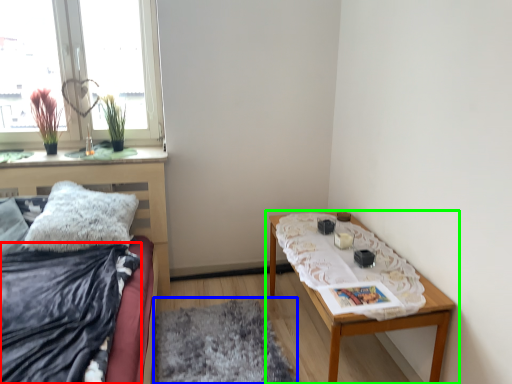
Question: Which object is positioned closest to blanket (highlighted by a red box)? Select from mat (highlighted by a blue box) and table (highlighted by a green box).

Choices:
 (A) mat
 (B) table

Answer: (A)